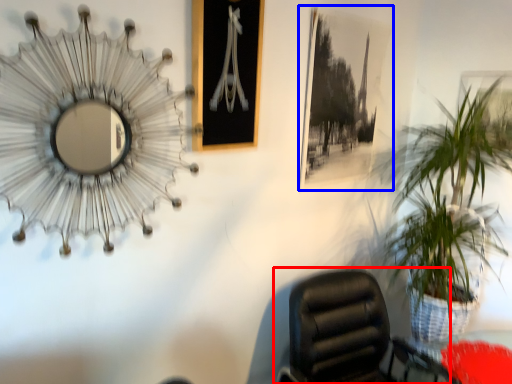
Question: Among these objects, which one is nearest to the camera, chair (highlighted by a red box) or picture frame (highlighted by a blue box)?

Choices:
 (A) chair
 (B) picture frame

Answer: (A)